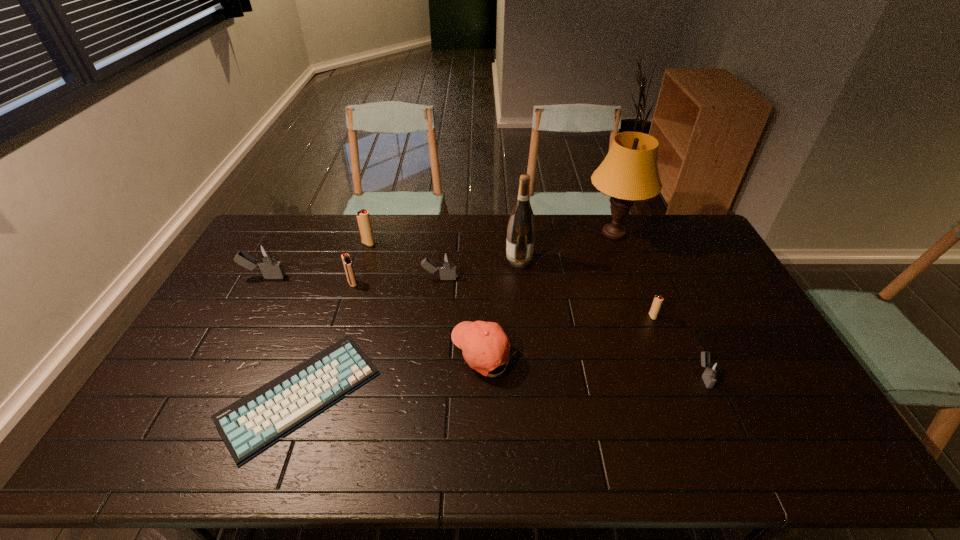
This screenshot has height=540, width=960. What are the coordinates of `the seventh farthest object` in the screenshot? It's located at (658, 300).

Where is `the fifth igniter from left to right`? This screenshot has height=540, width=960. the fifth igniter from left to right is located at coordinates click(658, 300).

Locate an element on the screen. The height and width of the screenshot is (540, 960). the nearest igniter is located at coordinates (712, 368).

I want to click on the rightmost igniter, so click(712, 368).

Locate an element on the screen. This screenshot has height=540, width=960. computer keyboard is located at coordinates (249, 425).

Image resolution: width=960 pixels, height=540 pixels. In order to click on gray computer keyboard in this screenshot , I will do `click(249, 425)`.

Find the location of a particular element. vacant space located on the right of the beige lampshade is located at coordinates (689, 234).

At what (x,y) coordinates should I click in order to perform the action: click on vacant area situated on the label of the wine bottle. Please return your answer as a coordinate pair (x, y). Looking at the image, I should click on [x=480, y=260].

Where is `vacant area located 0.150m on the label of the wine bottle`? Image resolution: width=960 pixels, height=540 pixels. vacant area located 0.150m on the label of the wine bottle is located at coordinates (464, 260).

Locate an element on the screen. vacant space located on the label of the wine bottle is located at coordinates (424, 260).